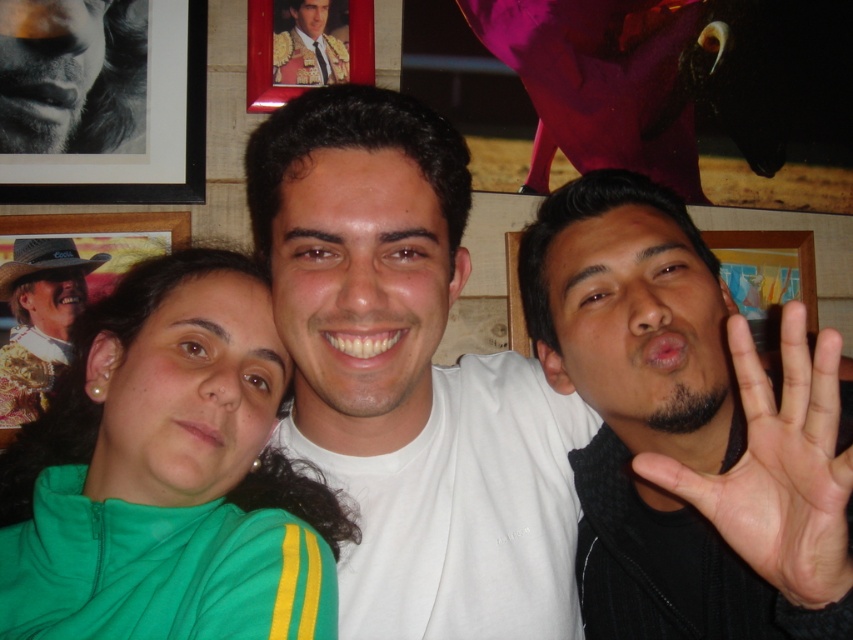
You are a photographer trying to capture a closeup of the matte black suit at upper center without including the smooth skin hand at right in the frame. Based on their positions, is this possible?

The smooth skin hand at right might be wider than matte black suit at upper center, so there is a possibility that the hand could block the view of the suit if they are positioned in a way that the hand extends beyond the suit in width. To ensure the suit is fully visible without the hand, the photographer might need to adjust the angle or composition slightly to avoid overlap.

You are a photographer trying to decide where to place a new decorative pillow for a photo shoot. The scene already has a green fabric at center and a matte black suit at upper center. Which object should you place the pillow next to if you want it to be near the larger item?

The green fabric at center is larger in size than the matte black suit at upper center, so you should place the pillow next to the green fabric at center.

Please look at the three people in the photo. The person on the left is wearing a green jacket with yellow stripes, the center person has a white tshirt and is smiling, and the right person is making a playful gesture. Where is the point located at coordinate [779,467] in relation to the smooth skin hand at right?

The point at [779,467] is where the smooth skin hand at right is located.